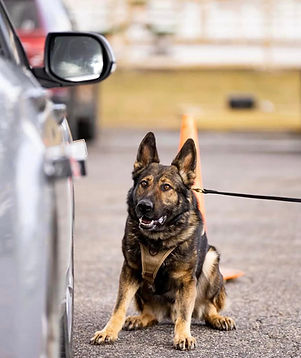
Locate an element on the screen. chest is located at coordinates (168, 280).